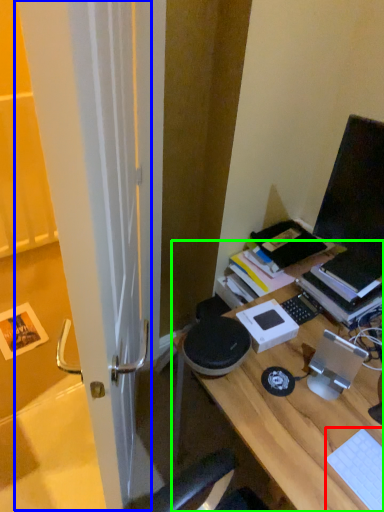
Question: Which is farther away from laptop keyboard (highlighted by a red box)? screen door (highlighted by a blue box) or desk (highlighted by a green box)?

Choices:
 (A) screen door
 (B) desk

Answer: (A)